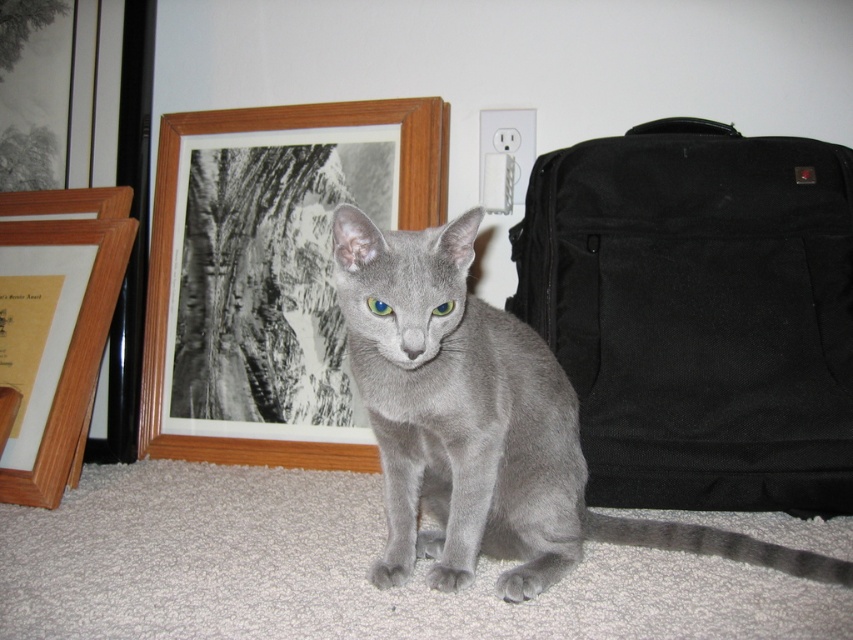
Between blue glossy eye at center and green matte eye at center, which one has less height?

blue glossy eye at center

Between blue glossy eye at center and green matte eye at center, which one appears on the right side from the viewer's perspective?

From the viewer's perspective, green matte eye at center appears more on the right side.

Is point (376, 314) positioned after point (444, 307)?

No, it is not.

This screenshot has width=853, height=640. Find the location of `blue glossy eye at center`. blue glossy eye at center is located at coordinates (378, 307).

Is black canvas suitcase at right further to camera compared to gray matte fur cat at center?

Yes, black canvas suitcase at right is behind gray matte fur cat at center.

Does black canvas suitcase at right appear over gray matte fur cat at center?

Correct, black canvas suitcase at right is located above gray matte fur cat at center.

Describe the element at coordinates (698, 314) in the screenshot. I see `black canvas suitcase at right` at that location.

The height and width of the screenshot is (640, 853). I want to click on black canvas suitcase at right, so click(698, 314).

Based on the photo, is gray matte fur cat at center behind wooden picture frame at left?

No, gray matte fur cat at center is in front of wooden picture frame at left.

Between gray matte fur cat at center and wooden picture frame at left, which one has less height?

gray matte fur cat at center

Where is `gray matte fur cat at center`? gray matte fur cat at center is located at coordinates (485, 426).